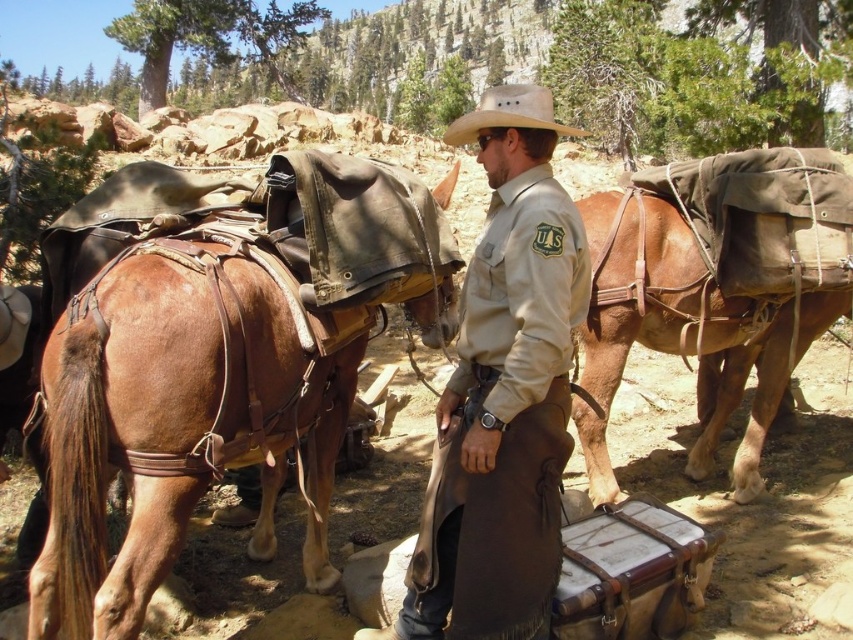
Question: Is the position of brown leather saddle at center less distant than that of tan leather cowboy hat at center?

Choices:
 (A) yes
 (B) no

Answer: (B)

Question: Estimate the real-world distances between objects in this image. Which object is farther from the brown leather saddle at left?

Choices:
 (A) tan leather cowboy hat at center
 (B) khaki uniform at center
 (C) brown leather saddle at center

Answer: (C)

Question: Does brown leather saddle at center have a larger size compared to tan leather cowboy hat at center?

Choices:
 (A) yes
 (B) no

Answer: (B)

Question: Considering the relative positions of brown leather saddle at left and brown leather saddle at center in the image provided, where is brown leather saddle at left located with respect to brown leather saddle at center?

Choices:
 (A) left
 (B) right

Answer: (A)

Question: Which point is farther from the camera taking this photo?

Choices:
 (A) (724, 356)
 (B) (526, 227)

Answer: (A)

Question: Among these points, which one is farthest from the camera?

Choices:
 (A) (471, 134)
 (B) (258, 554)
 (C) (492, 573)

Answer: (B)